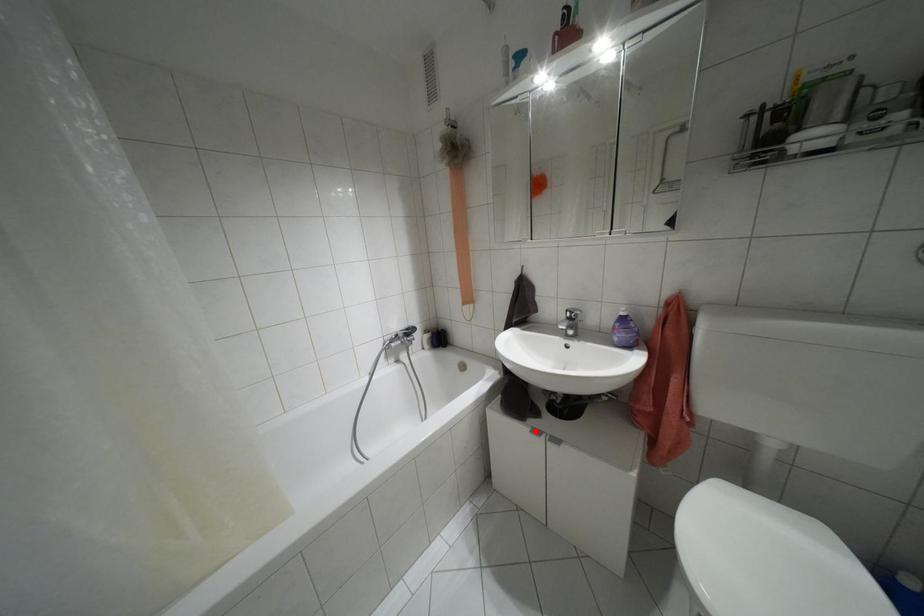
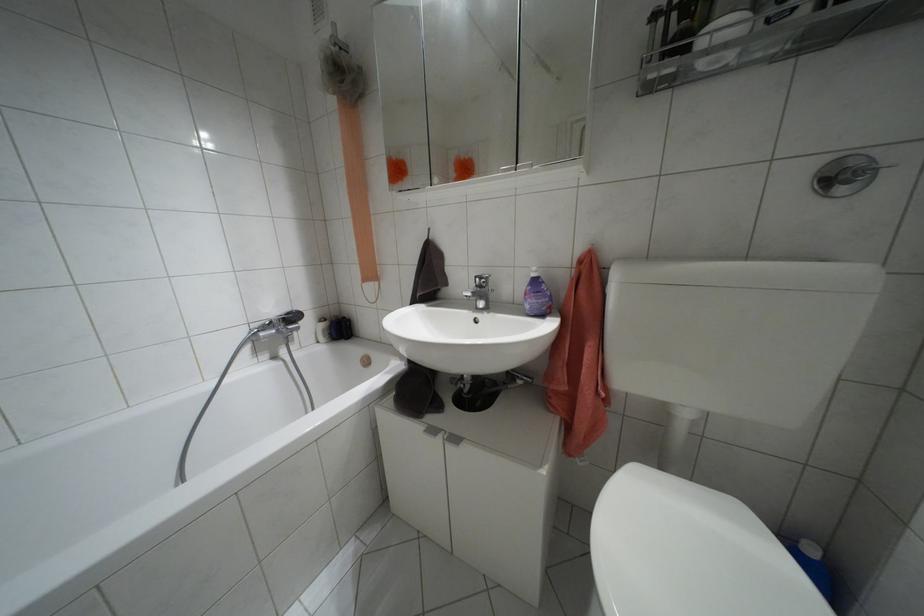
In the second image, find the point that corresponds to the highlighted location in the first image.

(432, 430)